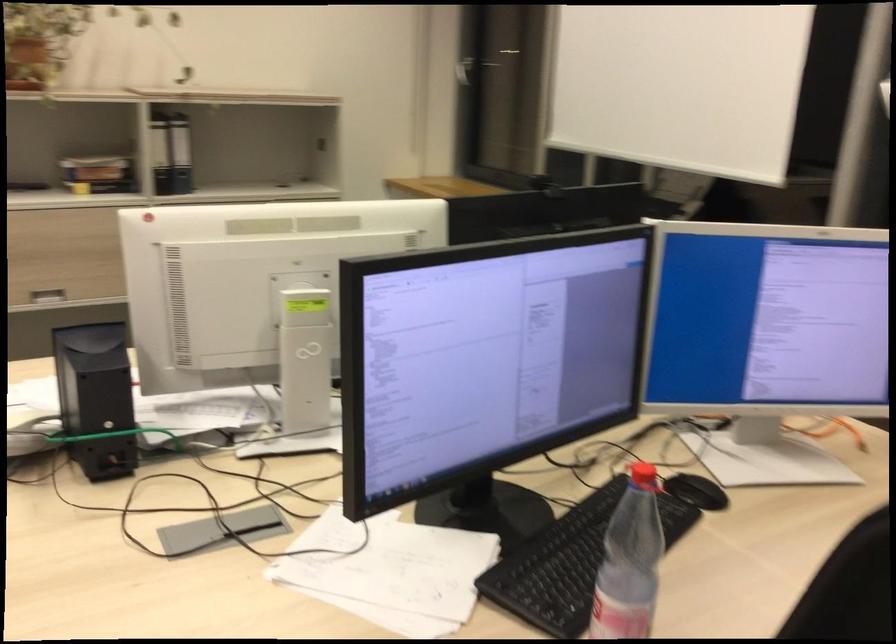
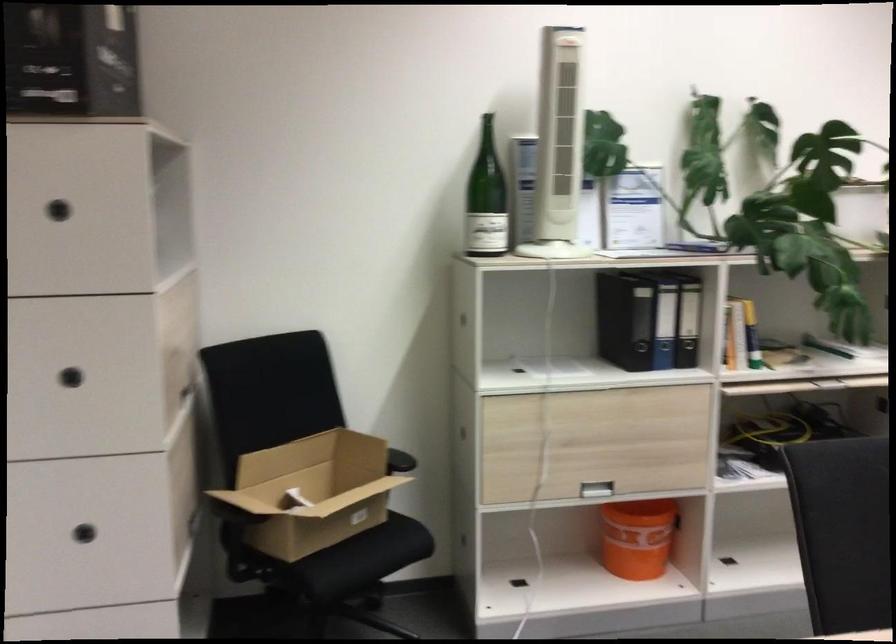
Question: What movement of the cameraman would produce the second image?

Choices:
 (A) Left
 (B) Right
 (C) Forward
 (D) Backward

Answer: (A)